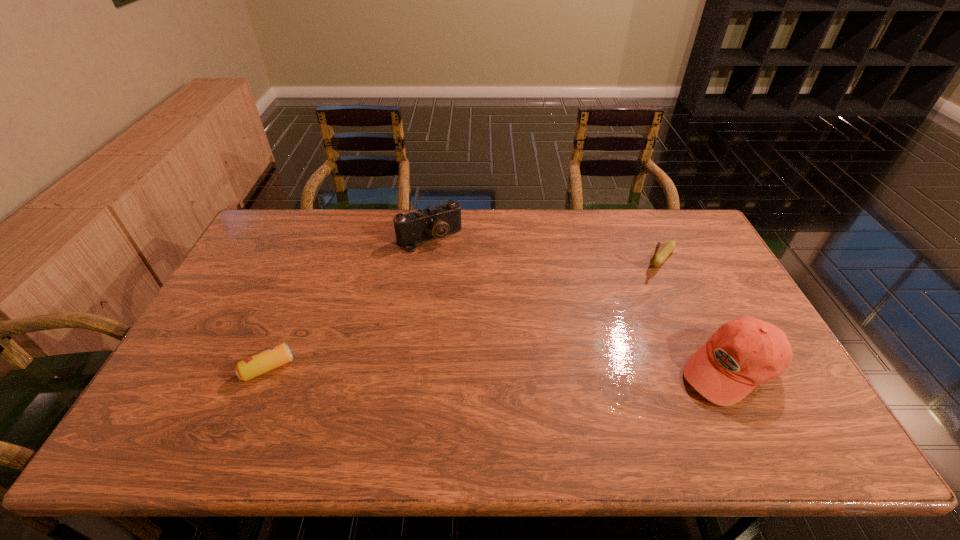
Where is `vacant space that's between the baseball cap and the banana`? vacant space that's between the baseball cap and the banana is located at coordinates (696, 313).

The width and height of the screenshot is (960, 540). I want to click on free spot between the tallest object and the banana, so click(696, 313).

At what (x,y) coordinates should I click in order to perform the action: click on unoccupied position between the leftmost object and the baseball cap. Please return your answer as a coordinate pair (x, y). This screenshot has width=960, height=540. Looking at the image, I should click on (499, 368).

Locate an element on the screen. free space between the camera and the baseball cap is located at coordinates (580, 303).

Where is `vacant point located between the leftmost object and the baseball cap`? This screenshot has width=960, height=540. vacant point located between the leftmost object and the baseball cap is located at coordinates point(499,368).

Where is `unoccupied area between the baseball cap and the banana`? The width and height of the screenshot is (960, 540). unoccupied area between the baseball cap and the banana is located at coordinates (696, 313).

At what (x,y) coordinates should I click in order to perform the action: click on vacant space that's between the banana and the leftmost object. Please return your answer as a coordinate pair (x, y). This screenshot has height=540, width=960. Looking at the image, I should click on (465, 313).

This screenshot has height=540, width=960. I want to click on free spot between the banana and the baseball cap, so click(x=696, y=313).

Point out which object is positioned as the nearest to the third object from right to left. Please provide its 2D coordinates. Your answer should be formatted as a tuple, i.e. [(x, y)], where the tuple contains the x and y coordinates of a point satisfying the conditions above.

[(256, 365)]

I want to click on object identified as the second closest to the banana, so click(x=436, y=221).